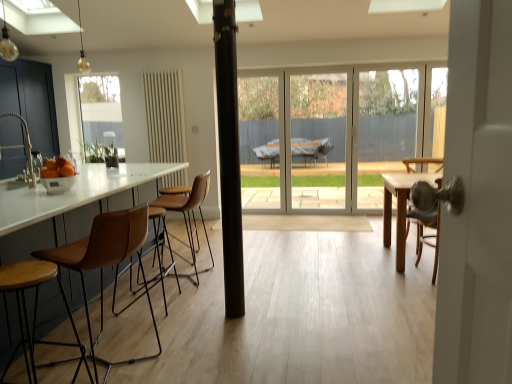
Locate an element on the screen. Image resolution: width=512 pixels, height=384 pixels. free location to the right of black matte pole at center is located at coordinates (261, 308).